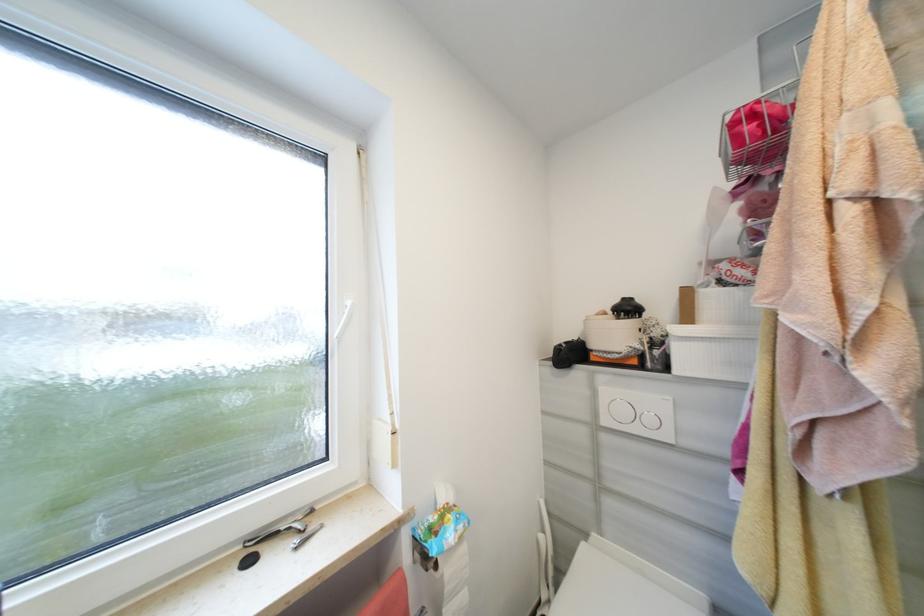
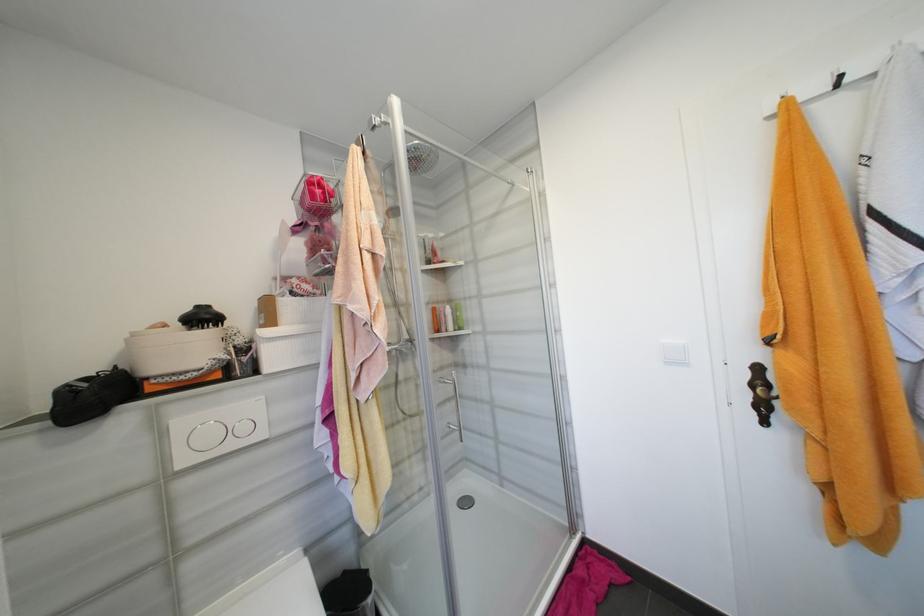
Find the pixel in the second image that matches (612,422) in the first image.

(189, 463)